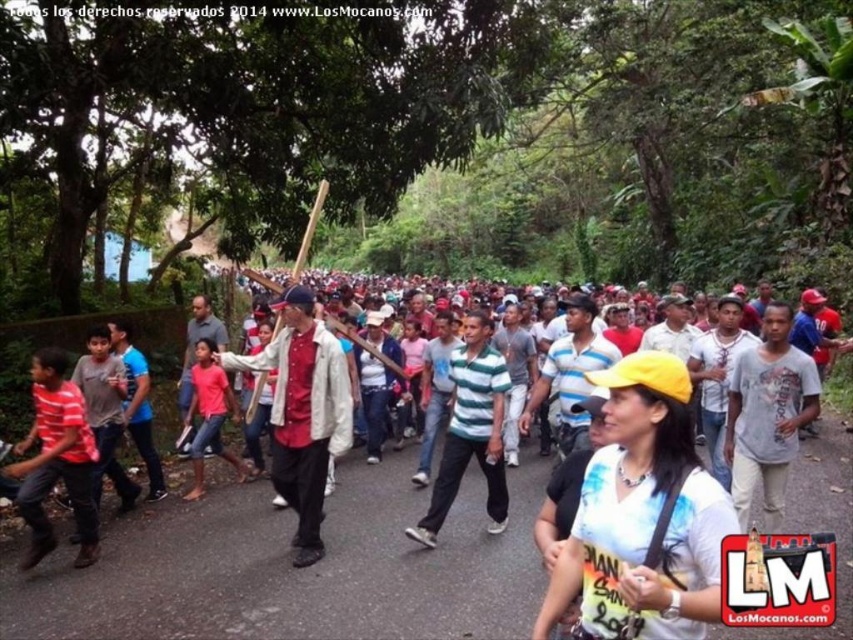
Who is taller, red shirt at center or striped cotton shirt at left?

red shirt at center is taller.

Does point (277, 433) come closer to viewer compared to point (39, 477)?

No, it is behind (39, 477).

Locate an element on the screen. The width and height of the screenshot is (853, 640). red shirt at center is located at coordinates pos(302,412).

Which is below, yellow fabric shirt at center or yellow matte cap at center?

Positioned lower is yellow fabric shirt at center.

The width and height of the screenshot is (853, 640). Describe the element at coordinates (292, 570) in the screenshot. I see `yellow fabric shirt at center` at that location.

In order to click on yellow fabric shirt at center in this screenshot , I will do `click(292, 570)`.

In the scene shown: Is yellow matte cap at center in front of red shirt at center?

Yes, it is.

Can you confirm if yellow matte cap at center is thinner than red shirt at center?

Yes, yellow matte cap at center is thinner than red shirt at center.

Between point (611, 628) and point (331, 392), which one is positioned in front?

Positioned in front is point (611, 628).

I want to click on yellow matte cap at center, so click(642, 516).